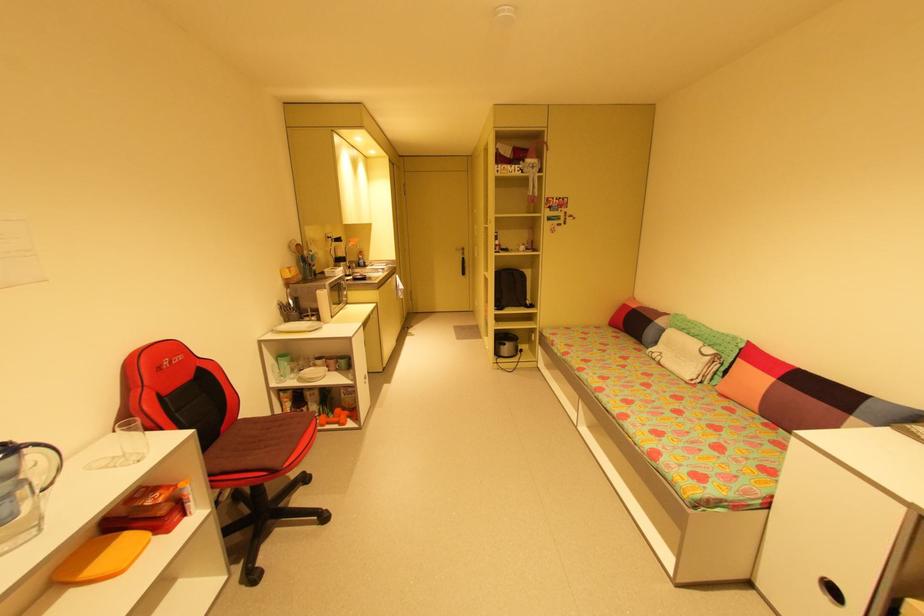
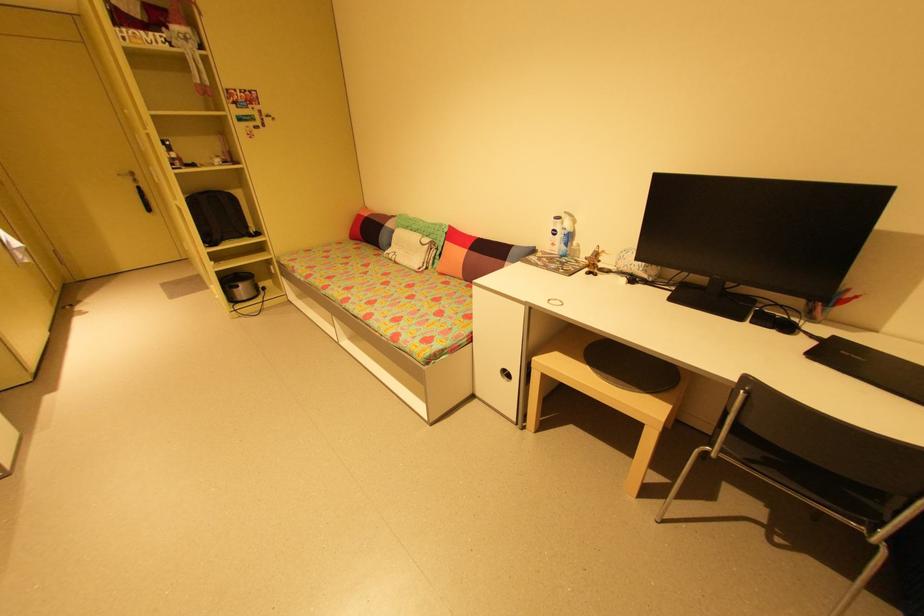
Where in the second image is the point corresponding to (x=638, y=307) from the first image?

(371, 215)